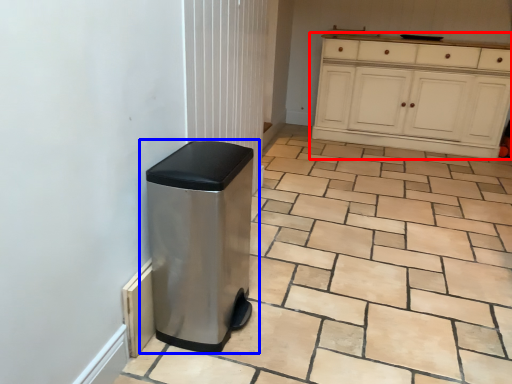
Question: Which of the following is the farthest to the observer, cabinetry (highlighted by a red box) or waste container (highlighted by a blue box)?

Choices:
 (A) cabinetry
 (B) waste container

Answer: (A)